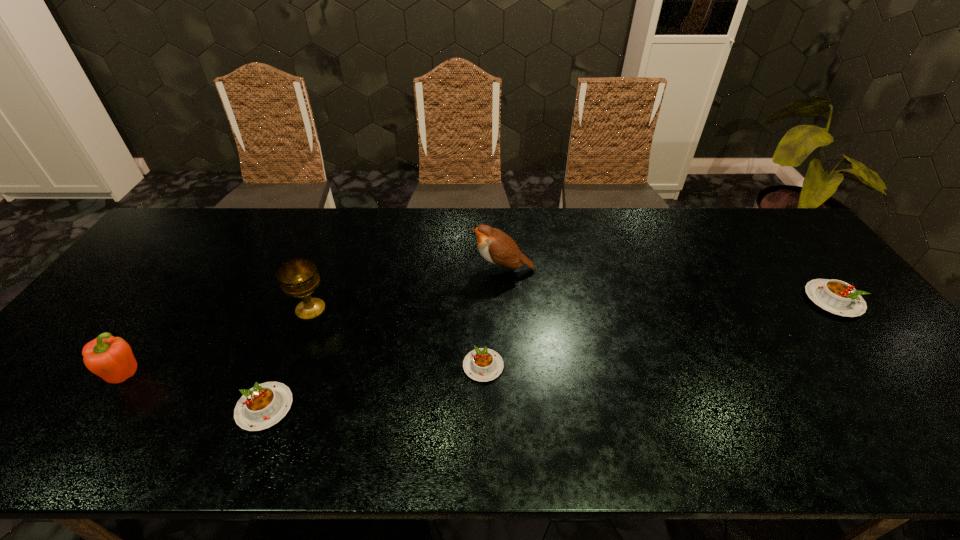
The height and width of the screenshot is (540, 960). What are the coordinates of `free space located 0.380m on the back of the shortest object` in the screenshot? It's located at 483,254.

Identify the location of vacant position located 0.250m on the back of the farthest pudding. (777, 231).

Identify the location of vacant space situated at the face of the bird. The width and height of the screenshot is (960, 540). (347, 269).

Locate an element on the screen. This screenshot has height=540, width=960. free region located at the face of the bird is located at coordinates (409, 269).

The height and width of the screenshot is (540, 960). Find the location of `vacant position located 0.210m at the face of the bird`. vacant position located 0.210m at the face of the bird is located at coordinates (402, 269).

Locate an element on the screen. The width and height of the screenshot is (960, 540). vacant space located 0.050m on the front of the pepper is located at coordinates (102, 411).

Locate an element on the screen. This screenshot has width=960, height=540. vacant space located 0.060m on the front of the chalice is located at coordinates (299, 340).

This screenshot has width=960, height=540. Identify the location of pepper at the near edge. (111, 358).

Where is `object at the left edge`? The width and height of the screenshot is (960, 540). object at the left edge is located at coordinates (111, 358).

This screenshot has height=540, width=960. Find the location of `object at the right edge`. object at the right edge is located at coordinates (838, 297).